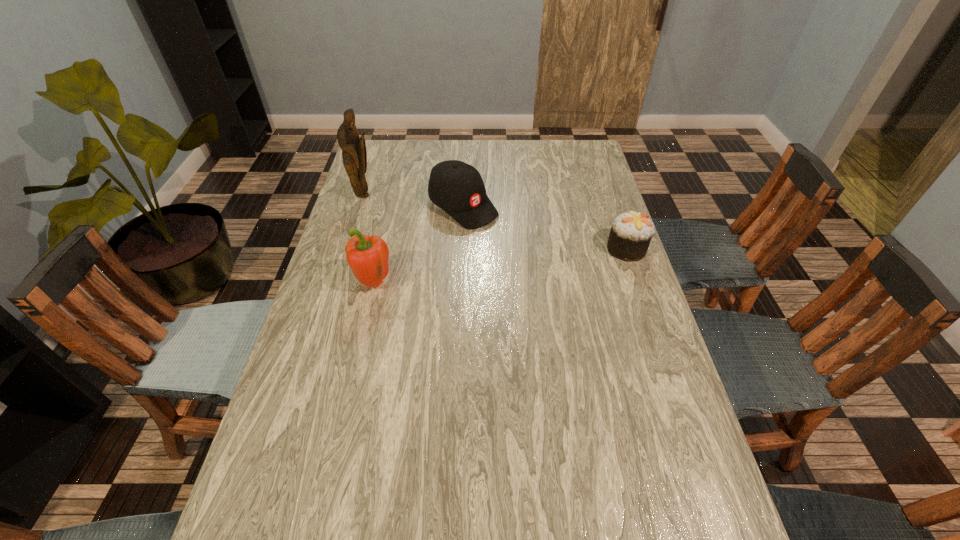
Where is `free point at the left edge`? free point at the left edge is located at coordinates (349, 381).

Locate an element on the screen. vacant space at the right edge of the desktop is located at coordinates (638, 375).

Locate an element on the screen. The height and width of the screenshot is (540, 960). vacant region at the near left corner of the desktop is located at coordinates (318, 487).

You are a GUI agent. You are given a task and a screenshot of the screen. Output one action in this format:
    pyautogui.click(x=<x>, y=<y>)
    Task: Click on the free space between the tallest object and the cupcake
    
    Given the screenshot: What is the action you would take?
    pyautogui.click(x=495, y=222)

The image size is (960, 540). I want to click on vacant space that is in between the baseball cap and the tallest object, so click(414, 201).

Identify the location of blank region between the tallest object and the third farthest object. This screenshot has height=540, width=960. (495, 222).

You are a GUI agent. You are given a task and a screenshot of the screen. Output one action in this format:
    pyautogui.click(x=<x>, y=<y>)
    Task: Click on the blank region between the third farthest object and the leftmost object
    The image size is (960, 540).
    Given the screenshot: What is the action you would take?
    pyautogui.click(x=495, y=222)

This screenshot has height=540, width=960. I want to click on free space that is in between the leftmost object and the second nearest object, so click(495, 222).

Find the location of `free point between the third object from right to left and the baseball cap`. free point between the third object from right to left and the baseball cap is located at coordinates (419, 245).

Where is `free space between the third object from left to right and the leftmost object`? The width and height of the screenshot is (960, 540). free space between the third object from left to right and the leftmost object is located at coordinates (414, 201).